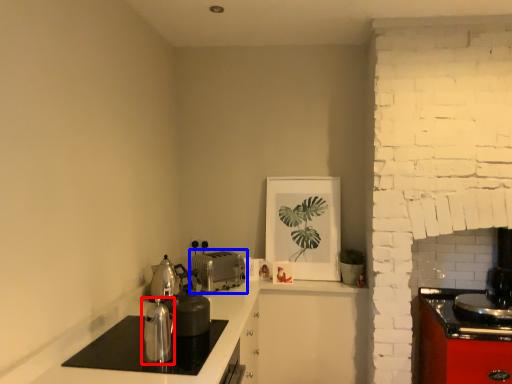
Question: Among these objects, which one is farthest to the camera, kitchen appliance (highlighted by a red box) or toaster (highlighted by a blue box)?

Choices:
 (A) kitchen appliance
 (B) toaster

Answer: (B)